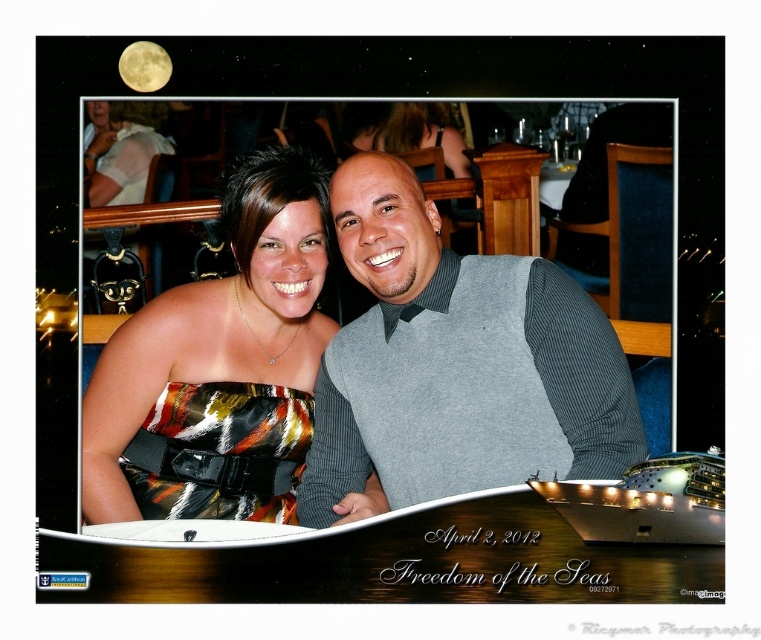
Question: Which object is closer to the camera taking this photo?

Choices:
 (A) shiny satin dress at center
 (B) gray ribbed sweater at center

Answer: (B)

Question: Where is gray ribbed sweater at center located in relation to shiny satin dress at center in the image?

Choices:
 (A) left
 (B) right

Answer: (B)

Question: Can you confirm if gray ribbed sweater at center is positioned to the right of shiny satin dress at center?

Choices:
 (A) yes
 (B) no

Answer: (A)

Question: Does gray ribbed sweater at center have a smaller size compared to shiny satin dress at center?

Choices:
 (A) no
 (B) yes

Answer: (B)